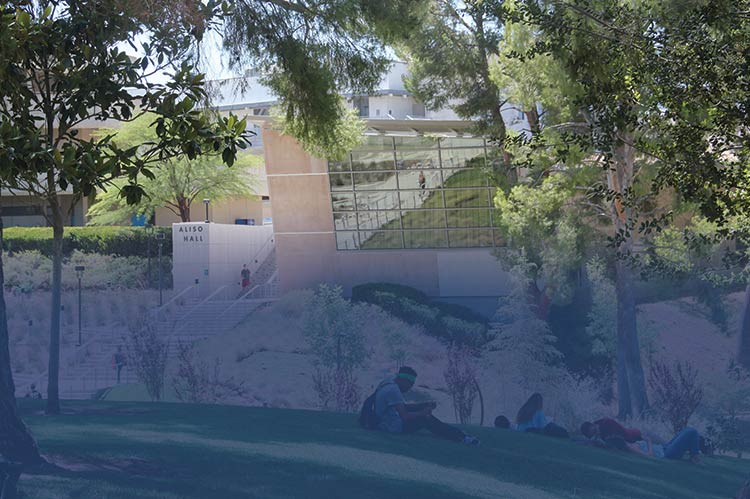
At what (x,y) coordinates should I click in order to perform the action: click on handrails on the stairs. Please return your answer as a coordinate pair (x, y). This screenshot has width=750, height=499. Looking at the image, I should click on 91,342, 104,355, 178,297, 199,304, 226,310, 268,278, 259,250.